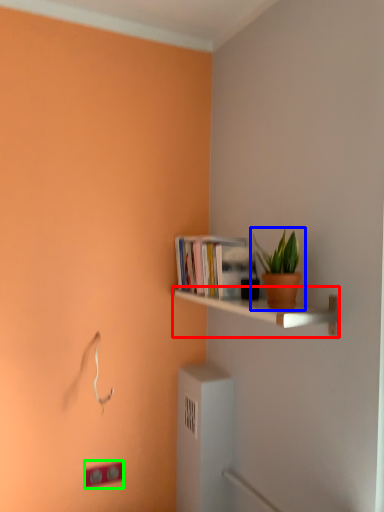
Question: Which object is positioned closest to shelf (highlighted by a red box)? Select from houseplant (highlighted by a blue box) and light switch (highlighted by a green box).

Choices:
 (A) houseplant
 (B) light switch

Answer: (A)